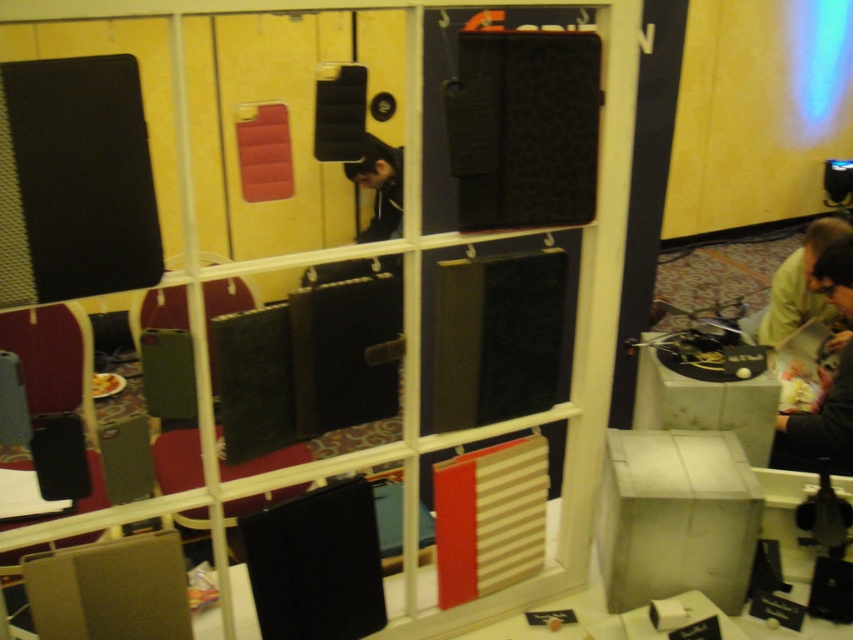
Does light beige fabric at lower right have a greater height compared to yellow matte shirt at lower right?

Indeed, light beige fabric at lower right has a greater height compared to yellow matte shirt at lower right.

Between light beige fabric at lower right and yellow matte shirt at lower right, which one has less height?

yellow matte shirt at lower right

The height and width of the screenshot is (640, 853). I want to click on light beige fabric at lower right, so click(x=819, y=426).

Is point (780, 337) positioned before point (386, 208)?

Yes, point (780, 337) is in front of point (386, 208).

Which is behind, point (782, 260) or point (386, 236)?

Positioned behind is point (782, 260).

At what (x,y) coordinates should I click in order to perform the action: click on yellow matte shirt at lower right. Please return your answer as a coordinate pair (x, y). Looking at the image, I should click on (804, 288).

From the picture: Between light beige fabric at lower right and black matte jacket at center, which one appears on the right side from the viewer's perspective?

light beige fabric at lower right

Who is lower down, light beige fabric at lower right or black matte jacket at center?

light beige fabric at lower right

Is point (798, 465) positioned behind point (392, 150)?

No, it is not.

The width and height of the screenshot is (853, 640). What are the coordinates of `light beige fabric at lower right` in the screenshot? It's located at (819, 426).